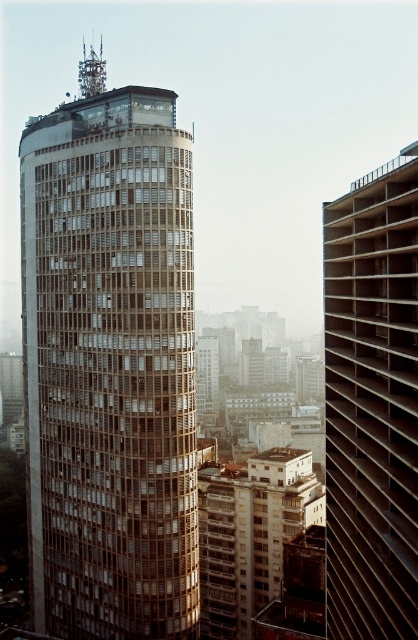
You are standing at a viewpoint where you can see the cityscape described. There is a specific point marked at coordinates point (140, 564). If you want to place a small flag at the base of the structure closest to this point, which structure should you choose between the tall cylindrical building and the secondary high rise to the right?

The point (140, 564) is closer to the tall cylindrical building than the secondary high rise to the right, so you should place the flag at the base of the tall cylindrical building.

You are an architect analyzing the city layout. You see the matte brown tower at center and the brown textured building at right. Which of these two buildings is closer to the observer?

The matte brown tower at center is closer to the observer because the brown textured building at right is behind it.

You are standing at the center of the city square, looking towards the skyline. A friend asks you to describe the exact position of the matte brown tower at center relative to the square. What do you tell them?

The matte brown tower at center is located at the coordinates point (109,364) relative to the square.